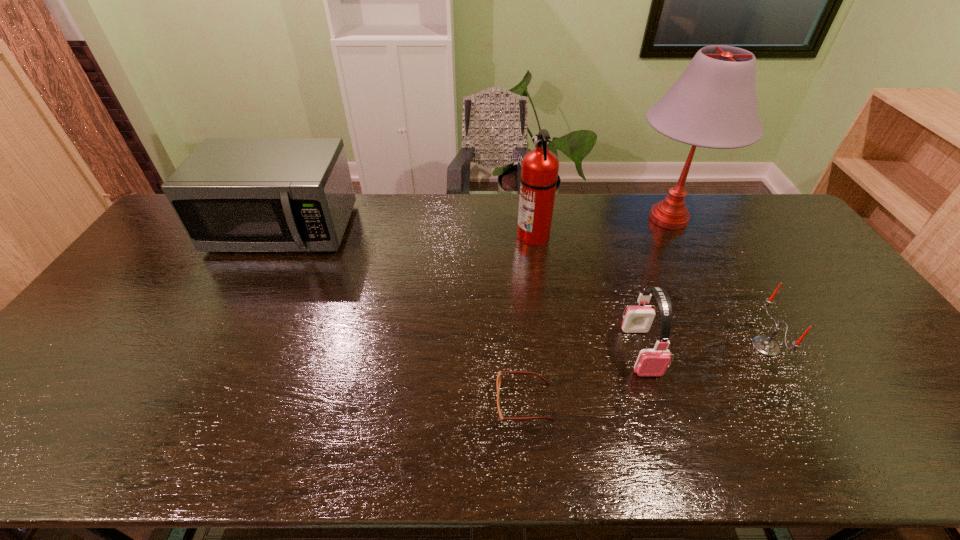
At what (x,y) coordinates should I click in order to perform the action: click on table lamp. Please return your answer as a coordinate pair (x, y). The image size is (960, 540). Looking at the image, I should click on (713, 104).

You are a GUI agent. You are given a task and a screenshot of the screen. Output one action in this format:
    pyautogui.click(x=<x>, y=<y>)
    Task: Click on the fire extinguisher
    The height and width of the screenshot is (540, 960).
    Given the screenshot: What is the action you would take?
    pyautogui.click(x=539, y=174)

Where is `the fourth shortest object`? The image size is (960, 540). the fourth shortest object is located at coordinates (231, 194).

Locate an element on the screen. the leftmost object is located at coordinates (231, 194).

Image resolution: width=960 pixels, height=540 pixels. I want to click on earphone, so click(x=638, y=319).

Find the location of a particular element. The width and height of the screenshot is (960, 540). the third object from right to left is located at coordinates (638, 319).

Locate an element on the screen. Image resolution: width=960 pixels, height=540 pixels. the second shortest object is located at coordinates (764, 345).

Identify the location of the nearest object. (498, 382).

This screenshot has height=540, width=960. In order to click on the shortest object in this screenshot , I will do `click(498, 382)`.

Find the location of a particular element. free space located on the front-facing side of the tallest object is located at coordinates (555, 219).